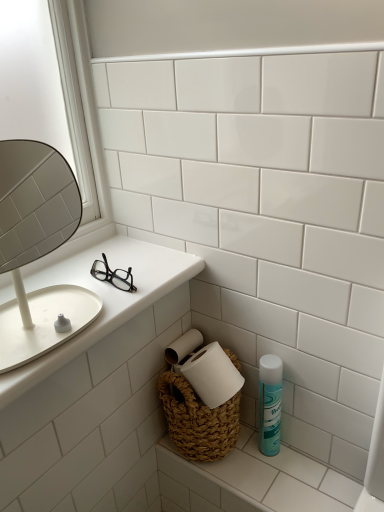
Question: Which is correct: white woven basket at lower right, placed as the first counter top when sorted from bottom to top, is inside white matte mirror at left, or outside of it?

Choices:
 (A) outside
 (B) inside

Answer: (A)

Question: Considering their positions, is white woven basket at lower right, the second counter top from the top, located in front of or behind white matte mirror at left?

Choices:
 (A) behind
 (B) front

Answer: (A)

Question: Which of these objects is positioned closest to the teal matte mouthwash at lower right?

Choices:
 (A) white matte mirror at left
 (B) white woven basket at lower right, placed as the first counter top when sorted from bottom to top
 (C) white glossy counter top at left, the 1th counter top from the left

Answer: (B)

Question: Estimate the real-world distances between objects in this image. Which object is farther from the teal matte mouthwash at lower right?

Choices:
 (A) white woven basket at lower right, placed as the first counter top when sorted from bottom to top
 (B) white matte mirror at left
 (C) white glossy counter top at left, placed as the second counter top when sorted from bottom to top

Answer: (B)